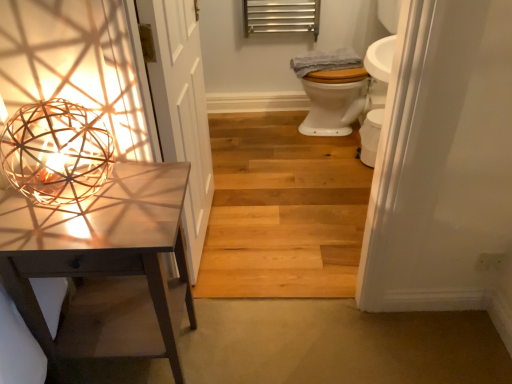
At what (x,y) coordinates should I click in order to perform the action: click on vacant point to the left of white glossy toilet bowl at center. Please return your answer as a coordinate pair (x, y). This screenshot has height=384, width=512. Looking at the image, I should click on (341, 163).